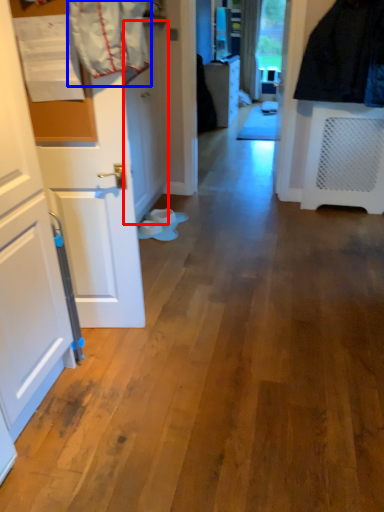
Question: Which object is further to the camera taking this photo, door (highlighted by a red box) or laundry (highlighted by a blue box)?

Choices:
 (A) door
 (B) laundry

Answer: (A)